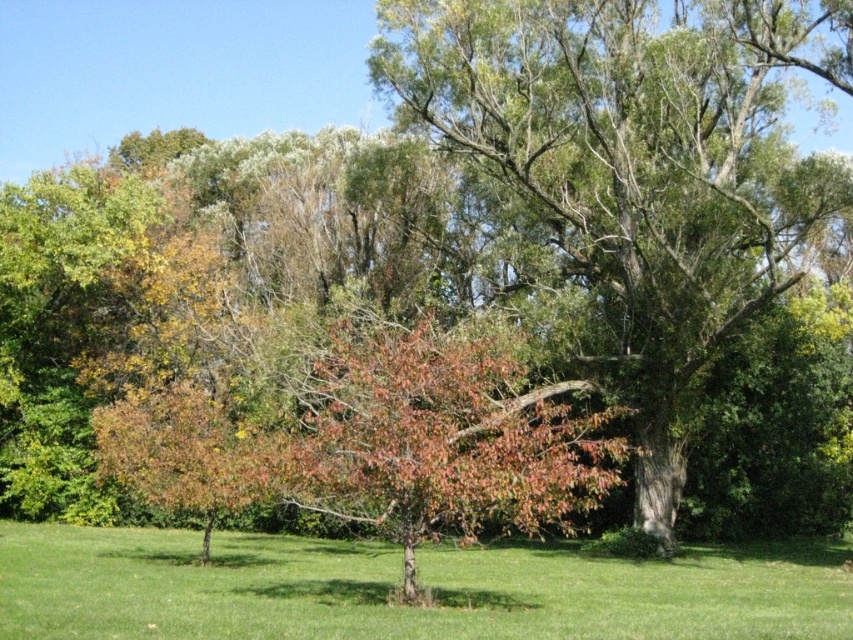
Is green leafy tree at center above green grass at center?

Correct, green leafy tree at center is located above green grass at center.

Between green leafy tree at center and green grass at center, which one appears on the right side from the viewer's perspective?

green leafy tree at center

Is point (809, 28) closer to camera compared to point (575, 570)?

No, it is behind (575, 570).

Where is `green leafy tree at center`? This screenshot has height=640, width=853. green leafy tree at center is located at coordinates click(634, 170).